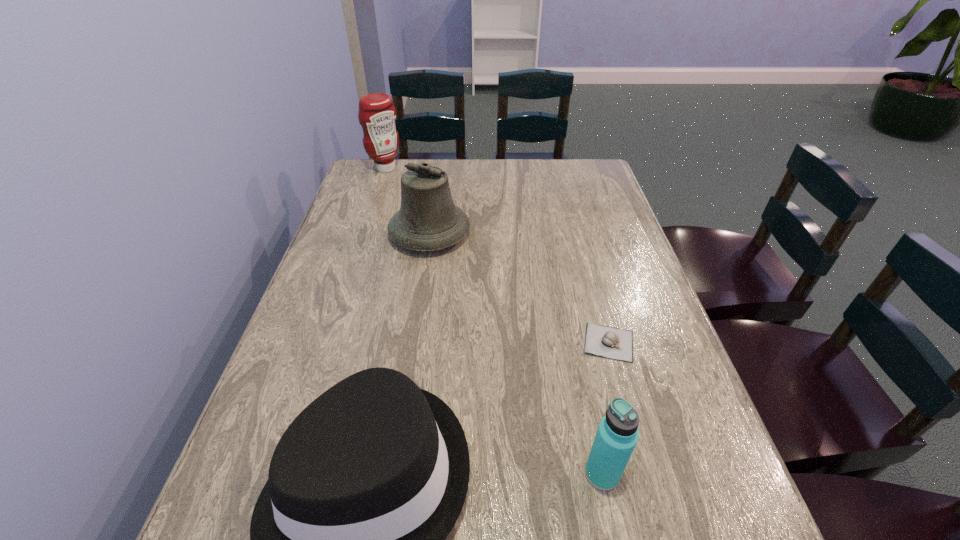
At what (x,y) coordinates should I click in order to perform the action: click on condiment. Please return your answer as a coordinate pair (x, y). The image size is (960, 540). Looking at the image, I should click on (377, 114).

The image size is (960, 540). Find the location of `bell`. bell is located at coordinates coord(428,220).

At what (x,y) coordinates should I click in order to perform the action: click on thermos bottle. Please return your answer as a coordinate pair (x, y). Looking at the image, I should click on (617, 435).

I want to click on the third nearest object, so click(603, 341).

Locate an element on the screen. garlic is located at coordinates (603, 341).

Locate an element on the screen. This screenshot has width=960, height=540. vacant area situated 0.260m on the right of the farthest object is located at coordinates (476, 168).

Find the location of a particular element. vacant region located on the front of the second farthest object is located at coordinates (422, 280).

Where is `vacant space located on the back of the thermos bottle`? vacant space located on the back of the thermos bottle is located at coordinates (583, 380).

Identify the location of free space located on the left of the shortest object. (434, 342).

You are a GUI agent. You are given a task and a screenshot of the screen. Output one action in this format:
    pyautogui.click(x=<x>, y=<y>)
    Task: Click on the object at the far edge
    The height and width of the screenshot is (540, 960).
    Given the screenshot: What is the action you would take?
    pyautogui.click(x=377, y=114)